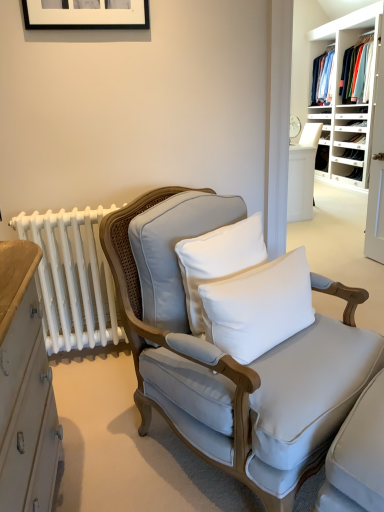
The image size is (384, 512). What are the coordinates of `white cotton pillow at center, which is counted as the second pillow, starting from the left` in the screenshot? It's located at (259, 307).

Image resolution: width=384 pixels, height=512 pixels. In order to click on blue cotton shirt at upper right in this screenshot , I will do `click(321, 77)`.

The width and height of the screenshot is (384, 512). I want to click on white wood shelves at upper right, so click(x=348, y=103).

From a real-world perspective, does white cotton pillow at center, which is counted as the second pillow, starting from the left, stand above light gray fabric chair at center?

Yes, from a real-world perspective, white cotton pillow at center, which is counted as the second pillow, starting from the left, is on top of light gray fabric chair at center.

Is point (220, 306) farther from viewer compared to point (273, 364)?

No.

How distant is white cotton pillow at center, which is counted as the second pillow, starting from the left, from light gray fabric chair at center?

7.88 inches.

Is there a large distance between white cotton pillow at center, positioned as the first pillow in right-to-left order, and light gray fabric chair at center?

That's not correct — white cotton pillow at center, positioned as the first pillow in right-to-left order, is a little close to light gray fabric chair at center.

Consider the image. Is light gray fabric chair at center taller than black matte picture frame at upper center?

Yes.

From a real-world perspective, who is located higher, light gray fabric chair at center or black matte picture frame at upper center?

In real-world perspective, black matte picture frame at upper center is above.

Can you confirm if light gray fabric chair at center is positioned to the right of black matte picture frame at upper center?

Indeed, light gray fabric chair at center is positioned on the right side of black matte picture frame at upper center.

Which point is more forward, [121,236] or [319,168]?

Point [121,236]

Considering the sizes of light gray fabric chair at center and white wood shelves at upper right in the image, is light gray fabric chair at center taller or shorter than white wood shelves at upper right?

In the image, light gray fabric chair at center appears to be shorter than white wood shelves at upper right.

Considering the relative sizes of light gray fabric chair at center and white wood shelves at upper right in the image provided, is light gray fabric chair at center bigger than white wood shelves at upper right?

No.

Does light gray fabric chair at center turn towards white wood shelves at upper right?

No.

Between point (138, 7) and point (333, 38), which one is positioned behind?

The point (333, 38) is more distant.

Considering the relative sizes of black matte picture frame at upper center and white wood shelves at upper right in the image provided, is black matte picture frame at upper center bigger than white wood shelves at upper right?

No, black matte picture frame at upper center is not bigger than white wood shelves at upper right.

Considering the sizes of objects black matte picture frame at upper center and white wood shelves at upper right in the image provided, who is wider, black matte picture frame at upper center or white wood shelves at upper right?

With larger width is white wood shelves at upper right.

Locate an element on the screen. This screenshot has width=384, height=512. shelf above the white cotton pillow at center, positioned as the 2th pillow in right-to-left order (from the image's perspective) is located at coordinates (348, 103).

Which object is wider, white cotton pillow at center, which appears as the first pillow when viewed from the left, or white wood shelves at upper right?

With larger width is white wood shelves at upper right.

In terms of size, does white cotton pillow at center, which appears as the first pillow when viewed from the left, appear bigger or smaller than white wood shelves at upper right?

In the image, white cotton pillow at center, which appears as the first pillow when viewed from the left, appears to be smaller than white wood shelves at upper right.

Is light gray fabric chair at center in front of or behind white cotton pillow at center, which is counted as the second pillow, starting from the left, in the image?

light gray fabric chair at center is in front of white cotton pillow at center, which is counted as the second pillow, starting from the left.

Between light gray fabric chair at center and white cotton pillow at center, positioned as the first pillow in right-to-left order, which one appears on the left side from the viewer's perspective?

light gray fabric chair at center.

Does light gray fabric chair at center have a larger size compared to white cotton pillow at center, positioned as the first pillow in right-to-left order?

Correct, light gray fabric chair at center is larger in size than white cotton pillow at center, positioned as the first pillow in right-to-left order.

Considering the positions of points (270, 278) and (319, 60), is point (270, 278) closer to camera compared to point (319, 60)?

Yes, it is in front of point (319, 60).

Is white cotton pillow at center, which is counted as the second pillow, starting from the left, facing towards blue cotton shirt at upper right?

No, white cotton pillow at center, which is counted as the second pillow, starting from the left, is not facing towards blue cotton shirt at upper right.

Which is more to the right, white cotton pillow at center, which is counted as the second pillow, starting from the left, or blue cotton shirt at upper right?

Positioned to the right is blue cotton shirt at upper right.

From a real-world perspective, relative to blue cotton shirt at upper right, is white cotton pillow at center, positioned as the first pillow in right-to-left order, vertically above or below?

white cotton pillow at center, positioned as the first pillow in right-to-left order, is below blue cotton shirt at upper right.

In the image, there is a white cotton pillow at center, positioned as the first pillow in right-to-left order. At what (x,y) coordinates should I click in order to perform the action: click on chair below it (from the image's perspective). Please return your answer as a coordinate pair (x, y). This screenshot has width=384, height=512. Looking at the image, I should click on (229, 356).

Find the location of a particular element. The width and height of the screenshot is (384, 512). chair below the black matte picture frame at upper center (from a real-world perspective) is located at coordinates (229, 356).

Looking at the image, which one is located closer to white wood shelves at upper right, blue cotton shirt at upper right or white cotton pillow at center, positioned as the first pillow in right-to-left order?

blue cotton shirt at upper right lies closer to white wood shelves at upper right than the other object.

Considering their positions, is white wood shelves at upper right positioned closer to blue cotton shirt at upper right than black matte picture frame at upper center?

The object closer to blue cotton shirt at upper right is white wood shelves at upper right.

Estimate the real-world distances between objects in this image. Which object is further from white cotton pillow at center, which is counted as the second pillow, starting from the left, black matte picture frame at upper center or blue cotton shirt at upper right?

blue cotton shirt at upper right is positioned further to the anchor white cotton pillow at center, which is counted as the second pillow, starting from the left.

Which object lies nearer to the anchor point blue cotton shirt at upper right, white cotton pillow at center, positioned as the first pillow in right-to-left order, or white wood shelves at upper right?

Among the two, white wood shelves at upper right is located nearer to blue cotton shirt at upper right.

Estimate the real-world distances between objects in this image. Which object is further from black matte picture frame at upper center, white cotton pillow at center, positioned as the first pillow in right-to-left order, or blue cotton shirt at upper right?

blue cotton shirt at upper right is positioned further to the anchor black matte picture frame at upper center.

Which object lies nearer to the anchor point white wood shelves at upper right, white cotton pillow at center, which is counted as the second pillow, starting from the left, or white cotton pillow at center, which appears as the first pillow when viewed from the left?

white cotton pillow at center, which appears as the first pillow when viewed from the left, is positioned closer to the anchor white wood shelves at upper right.

From the picture: Based on their spatial positions, is white cotton pillow at center, positioned as the 2th pillow in right-to-left order, or light gray fabric chair at center closer to white wood shelves at upper right?

white cotton pillow at center, positioned as the 2th pillow in right-to-left order.

In the scene shown: Which object lies nearer to the anchor point white cotton pillow at center, positioned as the 2th pillow in right-to-left order, black matte picture frame at upper center or white wood shelves at upper right?

black matte picture frame at upper center is closer to white cotton pillow at center, positioned as the 2th pillow in right-to-left order.

At what (x,y) coordinates should I click in order to perform the action: click on pillow that lies between black matte picture frame at upper center and white cotton pillow at center, which is counted as the second pillow, starting from the left, from top to bottom. Please return your answer as a coordinate pair (x, y). This screenshot has height=512, width=384. Looking at the image, I should click on (218, 260).

What are the coordinates of `pillow between white cotton pillow at center, positioned as the first pillow in right-to-left order, and white wood shelves at upper right in the front-back direction` in the screenshot? It's located at pos(218,260).

Find the location of a particular element. The width and height of the screenshot is (384, 512). pillow positioned between white cotton pillow at center, which is counted as the second pillow, starting from the left, and blue cotton shirt at upper right from near to far is located at coordinates (218, 260).

The width and height of the screenshot is (384, 512). I want to click on picture frame located between white cotton pillow at center, which is counted as the second pillow, starting from the left, and white wood shelves at upper right in the depth direction, so click(86, 14).